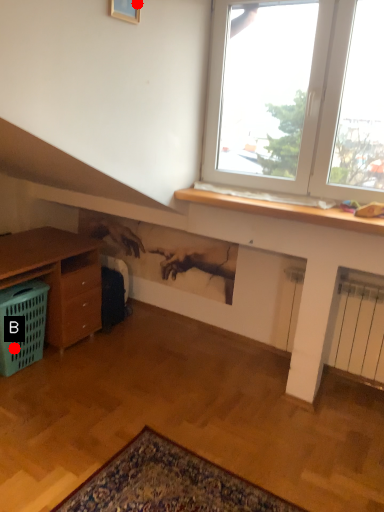
Question: Two points are circled on the image, labeled by A and B beside each circle. Which point is closer to the camera?

Choices:
 (A) A is closer
 (B) B is closer

Answer: (A)